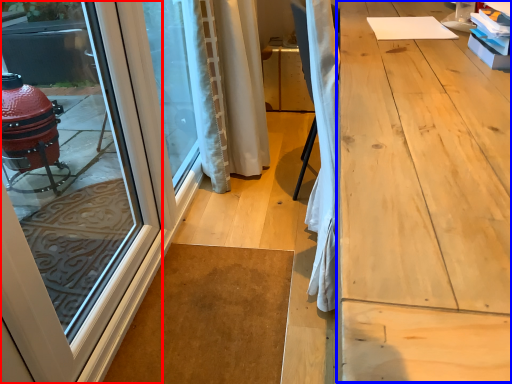
Question: Among these objects, which one is farthest to the camera, door (highlighted by a red box) or workbench (highlighted by a blue box)?

Choices:
 (A) door
 (B) workbench

Answer: (A)